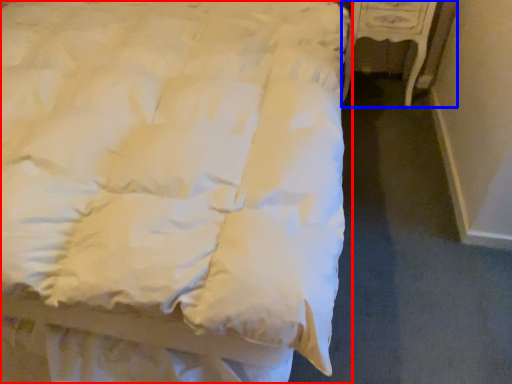
Question: Which point is closer to the camera, bed (highlighted by a red box) or furniture (highlighted by a blue box)?

Choices:
 (A) bed
 (B) furniture

Answer: (A)